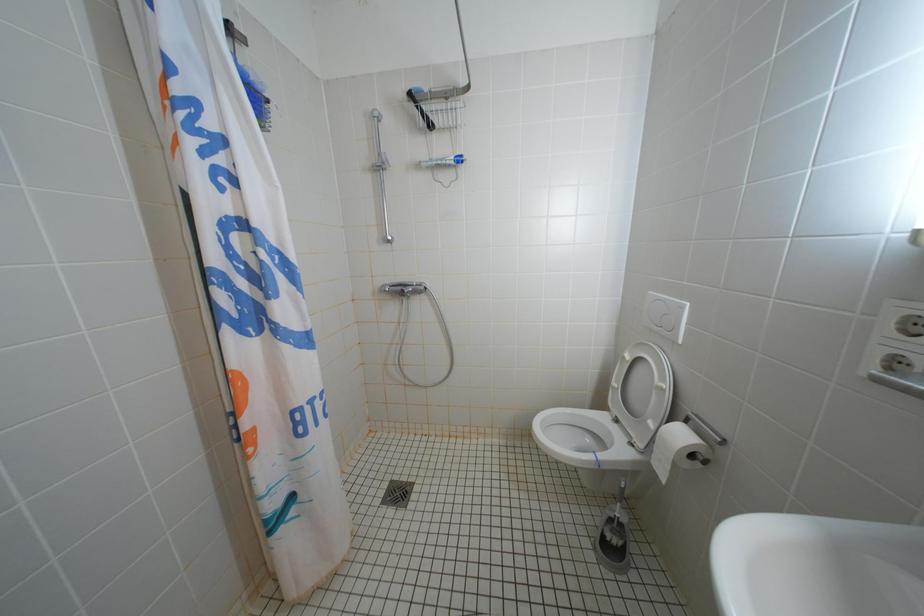
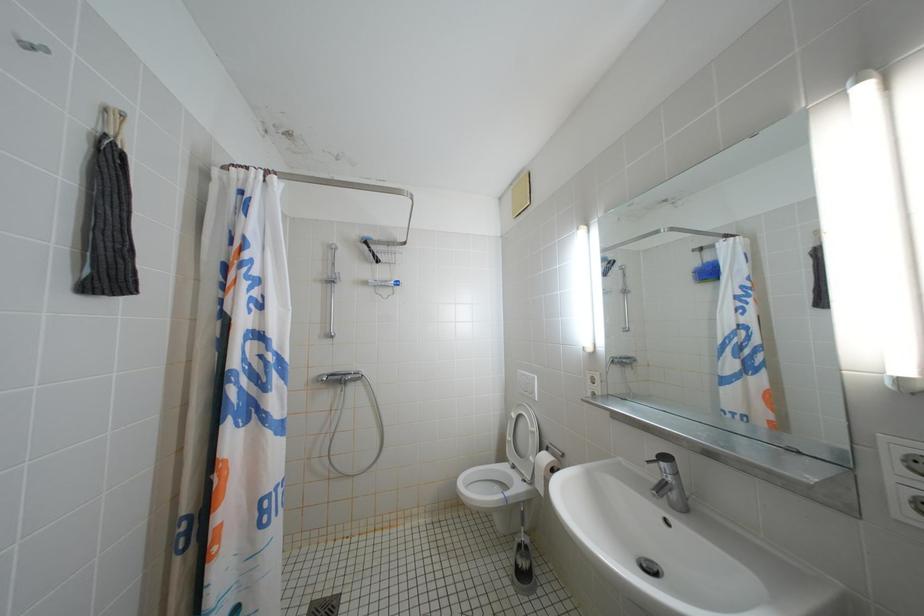
The images are taken continuously from a first-person perspective. In which direction are you moving?

The cameraman walked toward left, backward.